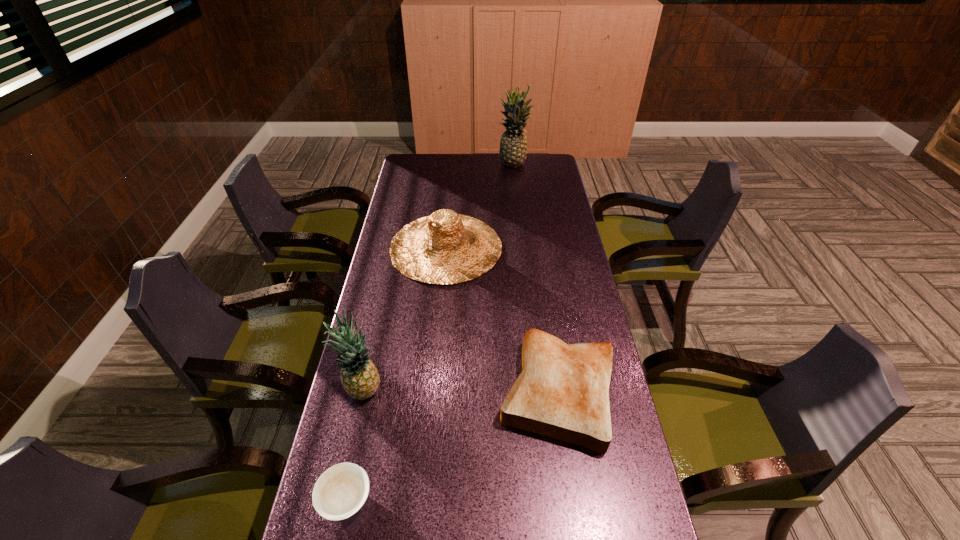
Where is `object that is at the far right corner`? object that is at the far right corner is located at coordinates (513, 146).

Where is `vacant space at the far edge`? The image size is (960, 540). vacant space at the far edge is located at coordinates (507, 170).

Locate an element on the screen. The image size is (960, 540). vacant space at the left edge of the desktop is located at coordinates (380, 320).

The image size is (960, 540). In the image, there is a desktop. Find the location of `vacant space at the right edge`. vacant space at the right edge is located at coordinates (567, 271).

At what (x,y) coordinates should I click in order to perform the action: click on vacant position at the far left corner of the desktop. Please return your answer as a coordinate pair (x, y). The image size is (960, 540). Looking at the image, I should click on (419, 160).

Find the location of a particular element. The width and height of the screenshot is (960, 540). vacant space at the far right corner is located at coordinates 533,163.

Where is `empty location between the nearest object and the second shortest object`? empty location between the nearest object and the second shortest object is located at coordinates (452, 445).

The height and width of the screenshot is (540, 960). Find the location of `free space between the right pineapple and the fourth tallest object`. free space between the right pineapple and the fourth tallest object is located at coordinates (536, 278).

Find the location of a particular element. Image resolution: width=960 pixels, height=540 pixels. free point between the nearer pineapple and the bread is located at coordinates (461, 390).

This screenshot has width=960, height=540. Identify the location of free spot between the second shortest object and the nearest object. (452, 445).